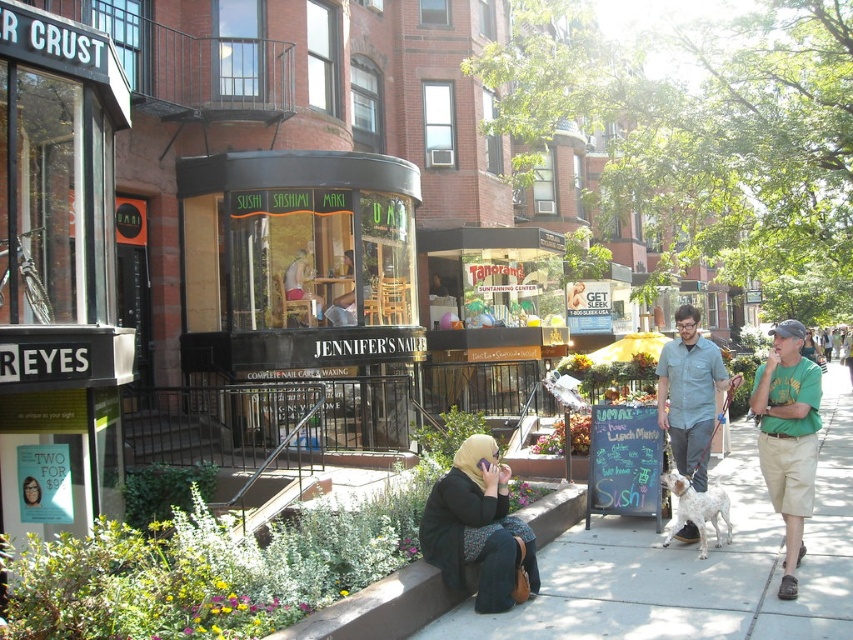
Based on the photo, please describe the exact position of the matte black hijab at center in the image using coordinates. The coordinate system has its origin at the bottom left corner of the image. The x and y axes increase to the right and upwards respectively. The coordinates are normalized between 0 and 1. Please provide the coordinates as a tuple of two decimal numbers rounded to three decimal places.

The matte black hijab at center is located at coordinates approximately equal to the point given in the Objects Description, which is at point (479,529).

You are a customer entering Jennifer Nails. You see a matte black hijab at center and a green cotton shirt at right. Which clothing item is narrower?

The matte black hijab at center has a lesser width compared to the green cotton shirt at right, so the matte black hijab at center is narrower.

You are a delivery person with a 3.5 feet wide cart. You need to move from the matte black glass storefront at center to the concrete sidewalk at lower center. Is there enough space for your cart to pass through the area between them?

The distance between the matte black glass storefront at center and the concrete sidewalk at lower center is 41.69 feet, which is significantly wider than the 3.5 feet width of the cart. Therefore, there is ample space for the cart to pass through the area between them.